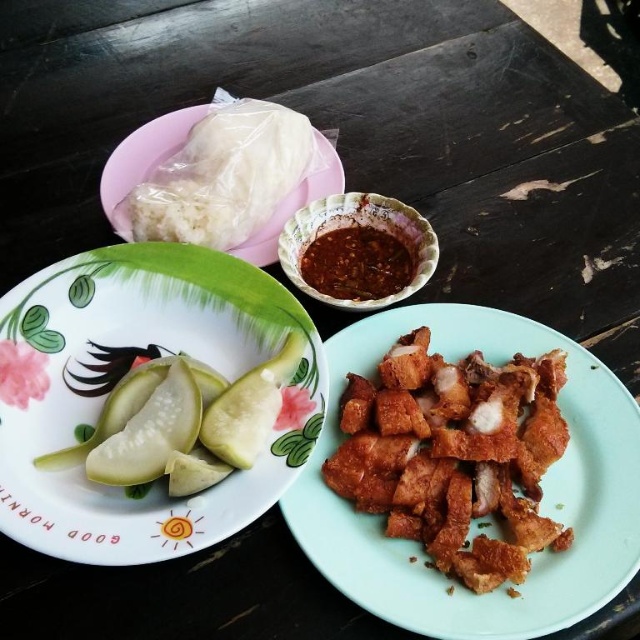
Is point (237, 522) farther from viewer compared to point (179, 426)?

No, it is in front of (179, 426).

Based on the photo, does green matte plate at left appear under green matte pickle at center-left?

No.

Is point (276, 284) behind point (152, 404)?

Yes, point (276, 284) is behind point (152, 404).

Locate an element on the screen. green matte plate at left is located at coordinates (116, 387).

Identify the location of green matte plate at left. (116, 387).

Between green matte plate at left and golden crispy fried pork at center, which one has less height?

green matte plate at left is shorter.

At what (x,y) coordinates should I click in order to perform the action: click on green matte plate at left. Please return your answer as a coordinate pair (x, y). The width and height of the screenshot is (640, 640). Looking at the image, I should click on (116, 387).

Locate an element on the screen. The width and height of the screenshot is (640, 640). green matte plate at left is located at coordinates (116, 387).

Does green translucent squash at center lie behind white soft rice at upper left?

No, it is in front of white soft rice at upper left.

The width and height of the screenshot is (640, 640). Describe the element at coordinates (182, 419) in the screenshot. I see `green translucent squash at center` at that location.

The image size is (640, 640). In order to click on green translucent squash at center in this screenshot , I will do `click(182, 419)`.